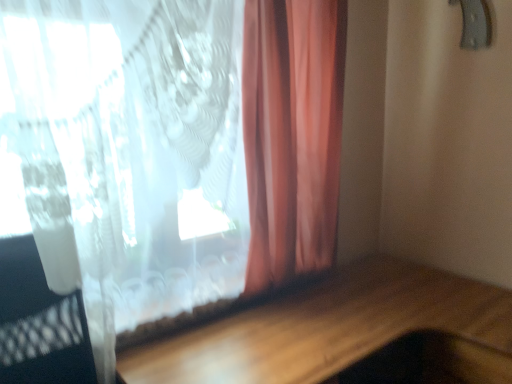
Question: Is translucent fabric curtain at upper left not within metallic gray door handle at upper right?

Choices:
 (A) yes
 (B) no

Answer: (A)

Question: Is the position of translucent fabric curtain at upper left less distant than that of metallic gray door handle at upper right?

Choices:
 (A) yes
 (B) no

Answer: (A)

Question: Can you confirm if translucent fabric curtain at upper left is shorter than metallic gray door handle at upper right?

Choices:
 (A) no
 (B) yes

Answer: (A)

Question: From the image's perspective, is translucent fabric curtain at upper left on metallic gray door handle at upper right?

Choices:
 (A) yes
 (B) no

Answer: (B)

Question: Is translucent fabric curtain at upper left to the right of metallic gray door handle at upper right from the viewer's perspective?

Choices:
 (A) yes
 (B) no

Answer: (B)

Question: Does point (479, 3) appear closer or farther from the camera than point (120, 188)?

Choices:
 (A) farther
 (B) closer

Answer: (A)

Question: In the image, is metallic gray door handle at upper right positioned in front of or behind translucent fabric curtain at upper left?

Choices:
 (A) behind
 (B) front

Answer: (A)

Question: Would you say metallic gray door handle at upper right is to the left or to the right of translucent fabric curtain at upper left in the picture?

Choices:
 (A) left
 (B) right

Answer: (B)

Question: From the image's perspective, relative to translucent fabric curtain at upper left, is metallic gray door handle at upper right above or below?

Choices:
 (A) below
 (B) above

Answer: (B)

Question: From a real-world perspective, is wooden table at lower center above or below metallic gray door handle at upper right?

Choices:
 (A) above
 (B) below

Answer: (B)

Question: From their relative heights in the image, would you say wooden table at lower center is taller or shorter than metallic gray door handle at upper right?

Choices:
 (A) short
 (B) tall

Answer: (B)

Question: Considering the positions of wooden table at lower center and metallic gray door handle at upper right in the image, is wooden table at lower center bigger or smaller than metallic gray door handle at upper right?

Choices:
 (A) small
 (B) big

Answer: (B)

Question: Relative to metallic gray door handle at upper right, is wooden table at lower center in front or behind?

Choices:
 (A) front
 (B) behind

Answer: (A)

Question: Is metallic gray door handle at upper right bigger or smaller than wooden table at lower center?

Choices:
 (A) small
 (B) big

Answer: (A)

Question: From their relative heights in the image, would you say metallic gray door handle at upper right is taller or shorter than wooden table at lower center?

Choices:
 (A) tall
 (B) short

Answer: (B)